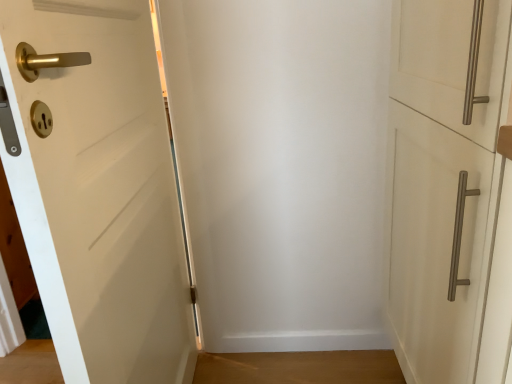
Question: Considering the relative sizes of white matte cabinet handle at right, positioned as the first door in right-to-left order, and white matte door at left, the 1th door positioned from the left, in the image provided, is white matte cabinet handle at right, positioned as the first door in right-to-left order, thinner than white matte door at left, the 1th door positioned from the left,?

Choices:
 (A) no
 (B) yes

Answer: (A)

Question: Is white matte cabinet handle at right, positioned as the first door in right-to-left order, beside white matte door at left, the 2th door viewed from the right?

Choices:
 (A) yes
 (B) no

Answer: (B)

Question: Considering the relative positions of white matte cabinet handle at right, positioned as the second door in left-to-right order, and white matte door at left, the 2th door viewed from the right, in the image provided, is white matte cabinet handle at right, positioned as the second door in left-to-right order, behind white matte door at left, the 2th door viewed from the right,?

Choices:
 (A) yes
 (B) no

Answer: (A)

Question: From the image's perspective, is white matte cabinet handle at right, positioned as the second door in left-to-right order, located beneath white matte door at left, the 1th door positioned from the left?

Choices:
 (A) yes
 (B) no

Answer: (B)

Question: Is white matte cabinet handle at right, positioned as the first door in right-to-left order, aimed at white matte door at left, the 2th door viewed from the right?

Choices:
 (A) no
 (B) yes

Answer: (B)

Question: Is white matte cabinet handle at right, positioned as the second door in left-to-right order, bigger than white matte door at left, the 2th door viewed from the right?

Choices:
 (A) yes
 (B) no

Answer: (A)

Question: Considering the relative sizes of white matte door at left, the 2th door viewed from the right, and white matte cabinet handle at right, positioned as the first door in right-to-left order, in the image provided, is white matte door at left, the 2th door viewed from the right, smaller than white matte cabinet handle at right, positioned as the first door in right-to-left order,?

Choices:
 (A) yes
 (B) no

Answer: (A)

Question: From the image's perspective, is white matte door at left, the 2th door viewed from the right, above white matte cabinet handle at right, positioned as the second door in left-to-right order?

Choices:
 (A) yes
 (B) no

Answer: (B)

Question: Is white matte door at left, the 1th door positioned from the left, beside white matte cabinet handle at right, positioned as the second door in left-to-right order?

Choices:
 (A) no
 (B) yes

Answer: (A)

Question: Is white matte door at left, the 2th door viewed from the right, oriented towards white matte cabinet handle at right, positioned as the second door in left-to-right order?

Choices:
 (A) yes
 (B) no

Answer: (A)

Question: Considering the relative sizes of white matte door at left, the 1th door positioned from the left, and white matte cabinet handle at right, positioned as the second door in left-to-right order, in the image provided, is white matte door at left, the 1th door positioned from the left, thinner than white matte cabinet handle at right, positioned as the second door in left-to-right order,?

Choices:
 (A) no
 (B) yes

Answer: (B)

Question: Considering the relative sizes of white matte door at left, the 2th door viewed from the right, and white matte cabinet handle at right, positioned as the first door in right-to-left order, in the image provided, is white matte door at left, the 2th door viewed from the right, taller than white matte cabinet handle at right, positioned as the first door in right-to-left order,?

Choices:
 (A) yes
 (B) no

Answer: (A)

Question: From the image's perspective, is white matte cabinet handle at right, positioned as the first door in right-to-left order, positioned above or below white matte door at left, the 2th door viewed from the right?

Choices:
 (A) below
 (B) above

Answer: (B)